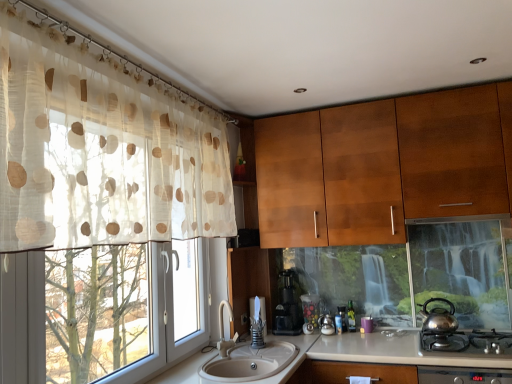
What do you see at coordinates (100, 149) in the screenshot?
I see `translucent beige polka dot curtain at left` at bounding box center [100, 149].

Where is `translucent plastic cup at center, which is the 1th appliance from right to left`? The height and width of the screenshot is (384, 512). translucent plastic cup at center, which is the 1th appliance from right to left is located at coordinates (342, 317).

Image resolution: width=512 pixels, height=384 pixels. What do you see at coordinates (459, 219) in the screenshot? I see `matte brown exhaust hood at upper center` at bounding box center [459, 219].

What do you see at coordinates (468, 342) in the screenshot? I see `polished stainless steel kettle at lower right` at bounding box center [468, 342].

Describe the element at coordinates (383, 166) in the screenshot. I see `wooden cabinet at upper center` at that location.

This screenshot has height=384, width=512. In order to click on translucent beige polka dot curtain at left in this screenshot , I will do `click(100, 149)`.

Is polished stainless steel kettle at lower right at the back of matte brown exhaust hood at upper center?

No, matte brown exhaust hood at upper center is not facing the opposite direction of polished stainless steel kettle at lower right.

How far apart are matte brown exhaust hood at upper center and polished stainless steel kettle at lower right?

They are 29.43 inches apart.

Is polished stainless steel kettle at lower right a part of matte brown exhaust hood at upper center?

No, polished stainless steel kettle at lower right is not a part of matte brown exhaust hood at upper center.

Who is bigger, matte brown exhaust hood at upper center or polished stainless steel kettle at lower right?

polished stainless steel kettle at lower right.

Choose the correct answer: Is wooden cabinet at upper center inside beige ceramic sink at lower center or outside it?

wooden cabinet at upper center is outside beige ceramic sink at lower center.

Is wooden cabinet at upper center next to beige ceramic sink at lower center and touching it?

No, wooden cabinet at upper center is not with beige ceramic sink at lower center.

How different are the orientations of wooden cabinet at upper center and beige ceramic sink at lower center in degrees?

They differ by 89.6 degrees in their facing directions.

Which is closer to the camera, (490, 208) or (169, 371)?

Point (490, 208) is positioned farther from the camera compared to point (169, 371).

Can you confirm if translucent plastic cup at center, which is the 1th appliance from right to left, is smaller than white glossy countertop at center?

Correct, translucent plastic cup at center, which is the 1th appliance from right to left, occupies less space than white glossy countertop at center.

Is translucent plastic cup at center, which is the 1th appliance from right to left, positioned with its back to white glossy countertop at center?

translucent plastic cup at center, which is the 1th appliance from right to left, is not turned away from white glossy countertop at center.

Is translucent plastic cup at center, which is the 1th appliance from right to left, outside of white glossy countertop at center?

That's correct, translucent plastic cup at center, which is the 1th appliance from right to left, is outside of white glossy countertop at center.

From a real-world perspective, which is physically below, wooden cabinet at upper center or translucent plastic jar at center, marked as the first appliance in a left-to-right arrangement?

translucent plastic jar at center, marked as the first appliance in a left-to-right arrangement, is physically lower.

Based on the photo, would you say translucent plastic jar at center, the 2th appliance positioned from the right, is part of wooden cabinet at upper center's contents?

No, translucent plastic jar at center, the 2th appliance positioned from the right, is located outside of wooden cabinet at upper center.

Where is `the 2nd appliance behind the wooden cabinet at upper center, starting your count from the anchor`? This screenshot has width=512, height=384. the 2nd appliance behind the wooden cabinet at upper center, starting your count from the anchor is located at coordinates click(x=310, y=308).

Could you measure the distance between wooden cabinet at upper center and translucent plastic jar at center, marked as the first appliance in a left-to-right arrangement?

A distance of 3.61 feet exists between wooden cabinet at upper center and translucent plastic jar at center, marked as the first appliance in a left-to-right arrangement.

From the image's perspective, which one is positioned lower, wooden cabinet at upper center or translucent plastic cup at center, which is the 1th appliance from right to left?

From the image's view, translucent plastic cup at center, which is the 1th appliance from right to left, is below.

Is wooden cabinet at upper center not inside translucent plastic cup at center, which is the 1th appliance from right to left?

Yes, wooden cabinet at upper center is outside of translucent plastic cup at center, which is the 1th appliance from right to left.

Based on the photo, is wooden cabinet at upper center oriented away from translucent plastic cup at center, which is the 1th appliance from right to left?

No, translucent plastic cup at center, which is the 1th appliance from right to left, is not at the back of wooden cabinet at upper center.

Is wooden cabinet at upper center placed right next to translucent plastic cup at center, which is the 1th appliance from right to left?

No, wooden cabinet at upper center is not in contact with translucent plastic cup at center, which is the 1th appliance from right to left.

Is black plastic coffee machine at center aimed at translucent plastic jar at center, the 2th appliance positioned from the right?

No, black plastic coffee machine at center is not oriented towards translucent plastic jar at center, the 2th appliance positioned from the right.

Considering the sizes of objects black plastic coffee machine at center and translucent plastic jar at center, marked as the first appliance in a left-to-right arrangement, in the image provided, who is taller, black plastic coffee machine at center or translucent plastic jar at center, marked as the first appliance in a left-to-right arrangement,?

With more height is black plastic coffee machine at center.

Can you confirm if black plastic coffee machine at center is positioned to the right of translucent plastic jar at center, the 2th appliance positioned from the right?

No, black plastic coffee machine at center is not to the right of translucent plastic jar at center, the 2th appliance positioned from the right.

Is black plastic coffee machine at center wider than translucent plastic jar at center, marked as the first appliance in a left-to-right arrangement?

Yes.

From the picture: Is shiny metallic teapot at right not close to translucent plastic jar at center, marked as the first appliance in a left-to-right arrangement?

No, shiny metallic teapot at right is in close proximity to translucent plastic jar at center, marked as the first appliance in a left-to-right arrangement.

Can we say shiny metallic teapot at right lies outside translucent plastic jar at center, the 2th appliance positioned from the right?

Yes, shiny metallic teapot at right is not within translucent plastic jar at center, the 2th appliance positioned from the right.

Looking at their sizes, would you say shiny metallic teapot at right is wider or thinner than translucent plastic jar at center, marked as the first appliance in a left-to-right arrangement?

Clearly, shiny metallic teapot at right has more width compared to translucent plastic jar at center, marked as the first appliance in a left-to-right arrangement.

Considering the relative positions of shiny metallic teapot at right and translucent plastic jar at center, marked as the first appliance in a left-to-right arrangement, in the image provided, is shiny metallic teapot at right to the left or to the right of translucent plastic jar at center, marked as the first appliance in a left-to-right arrangement,?

shiny metallic teapot at right is to the right of translucent plastic jar at center, marked as the first appliance in a left-to-right arrangement.

You are a GUI agent. You are given a task and a screenshot of the screen. Output one action in this format:
    pyautogui.click(x=<x>, y=<y>)
    Task: Click on the gas stove on the left of matte brown exhaust hood at upper center
    The width and height of the screenshot is (512, 384).
    Given the screenshot: What is the action you would take?
    pyautogui.click(x=468, y=342)

The width and height of the screenshot is (512, 384). There is a beige ceramic sink at lower center. Identify the location of cabinetry above it (from a real-world perspective). (383, 166).

From the image, which object appears to be nearer to translucent beige polka dot curtain at left, wooden cabinet at upper center or white glossy countertop at center?

wooden cabinet at upper center is positioned closer to the anchor translucent beige polka dot curtain at left.

Which object lies further to the anchor point translucent plastic jar at center, marked as the first appliance in a left-to-right arrangement, translucent beige polka dot curtain at left or translucent plastic cup at center, the 2th appliance in the left-to-right sequence?

Based on the image, translucent beige polka dot curtain at left appears to be further to translucent plastic jar at center, marked as the first appliance in a left-to-right arrangement.

From the image, which object appears to be farther from shiny metallic teapot at right, beige ceramic sink at lower center or polished stainless steel kettle at lower right?

beige ceramic sink at lower center is further to shiny metallic teapot at right.

Looking at the image, which one is located further to white glossy countertop at center, polished stainless steel kettle at lower right or wooden cabinet at upper center?

The object further to white glossy countertop at center is wooden cabinet at upper center.

From the image, which object appears to be nearer to black plastic coffee machine at center, translucent plastic cup at center, the 2th appliance in the left-to-right sequence, or beige ceramic sink at lower center?

translucent plastic cup at center, the 2th appliance in the left-to-right sequence, is positioned closer to the anchor black plastic coffee machine at center.

Based on their spatial positions, is translucent plastic cup at center, which is the 1th appliance from right to left, or wooden cabinet at upper center closer to matte brown exhaust hood at upper center?

Among the two, wooden cabinet at upper center is located nearer to matte brown exhaust hood at upper center.

When comparing their distances from white glossy countertop at center, does wooden cabinet at upper center or beige ceramic sink at lower center seem closer?

beige ceramic sink at lower center is positioned closer to the anchor white glossy countertop at center.

When comparing their distances from white glossy countertop at center, does wooden cabinet at upper center or black plastic coffee machine at center seem further?

The object further to white glossy countertop at center is wooden cabinet at upper center.

The width and height of the screenshot is (512, 384). Find the location of `coffee machine located between translucent beige polka dot curtain at left and polished stainless steel kettle at lower right in the left-right direction`. coffee machine located between translucent beige polka dot curtain at left and polished stainless steel kettle at lower right in the left-right direction is located at coordinates (287, 309).

This screenshot has height=384, width=512. What are the coordinates of `countertop between beige ceramic sink at lower center and translucent plastic jar at center, the 2th appliance positioned from the right, from front to back` in the screenshot? It's located at (381, 352).

Identify the location of counter top situated between translucent beige polka dot curtain at left and shiny metallic teapot at right from left to right. The height and width of the screenshot is (384, 512). (184, 370).

Locate an element on the screen. countertop between translucent beige polka dot curtain at left and shiny metallic teapot at right in the horizontal direction is located at coordinates (381, 352).